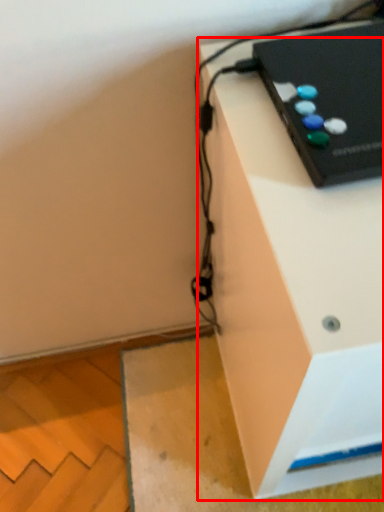
Question: From the image's perspective, what is the correct spatial relationship of furniture (annotated by the red box) in relation to computer?

Choices:
 (A) below
 (B) above

Answer: (A)